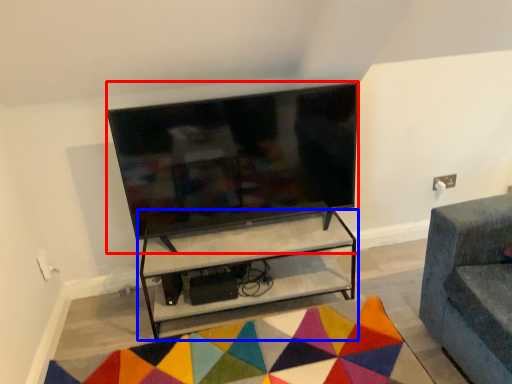
Question: Among these objects, which one is nearest to the camera, television (highlighted by a red box) or shelf (highlighted by a blue box)?

Choices:
 (A) television
 (B) shelf

Answer: (A)